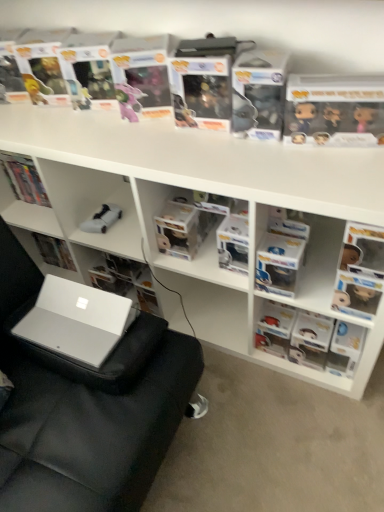
Question: Relative to white plastic shelves at upper center, is clear plastic book at upper center, the 2th paperback book when ordered from right to left, in front or behind?

Choices:
 (A) front
 (B) behind

Answer: (B)

Question: From a real-world perspective, is clear plastic book at upper center, placed as the first paperback book when sorted from left to right, positioned above or below white plastic shelves at upper center?

Choices:
 (A) below
 (B) above

Answer: (B)

Question: Which object is the closest to the matte plastic figurine at right, placed as the third book when sorted from left to right?

Choices:
 (A) silver metallic laptop at lower left
 (B) clear plastic container at center, positioned as the 2th book in right-to-left order
 (C) silver metallic swivel chair at lower left
 (D) white plastic shelves at upper center
 (E) clear plastic book at upper center, placed as the first paperback book when sorted from left to right

Answer: (D)

Question: Estimate the real-world distances between objects in this image. Which object is closer to the white matte book at center, the third book in the right-to-left sequence?

Choices:
 (A) clear plastic book at upper center, placed as the first paperback book when sorted from left to right
 (B) silver metallic laptop at lower left
 (C) silver metallic swivel chair at lower left
 (D) white matte remote control at center
 (E) white plastic shelves at upper center

Answer: (D)